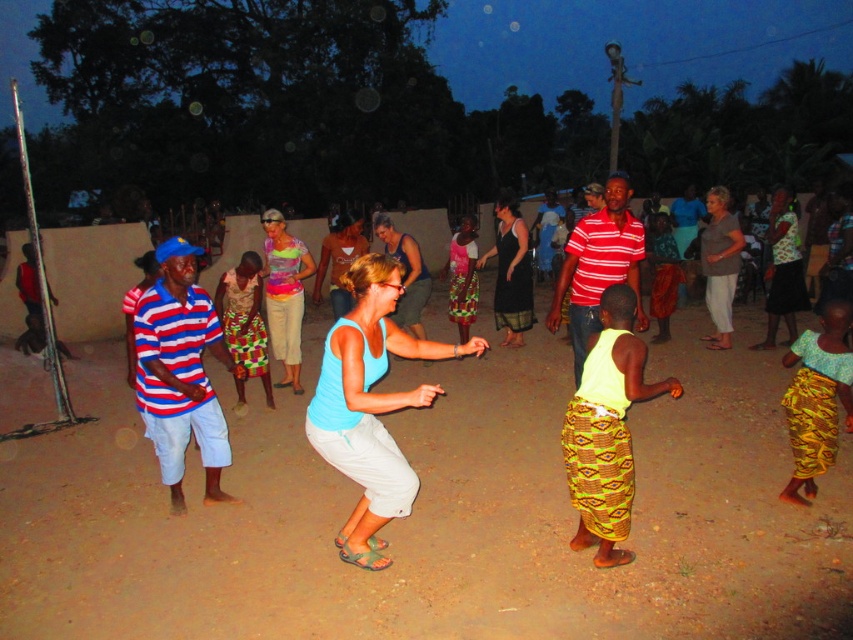
Consider the image. You are a photographer trying to capture the dancer in the yellow printed skirt at center without the multicolored fabric dress at center blocking the view. Based on their positions, is this possible?

The yellow printed skirt at center is in front of the multicolored fabric dress at center, so it is possible to capture the dancer in the yellow printed skirt at center without the multicolored fabric dress at center blocking the view.

You are a photographer standing at the edge of the gathering. You want to take a photo that includes both the yellow printed skirt at center and the multicolored fabric dress at center. Given that your camera has a maximum focus range of 12 feet, will both subjects be in focus?

The yellow printed skirt at center is 13.36 feet away from the multicolored fabric dress at center. Since the distance between them exceeds the camera focus range of 12 feet, both subjects cannot be in focus simultaneously.

In the scene, there are two men wearing striped cotton shirts. One is at the left and the other is at the center. From the perspective of someone standing in the middle of the gathering, which direction would the man in the striped cotton shirt at left be relative to the man in the striped cotton shirt at center?

The striped cotton shirt at left is positioned to the left of the striped cotton shirt at center, so from the middle of the gathering, the man in the striped cotton shirt at left would be to the left side relative to the man in the striped cotton shirt at center.